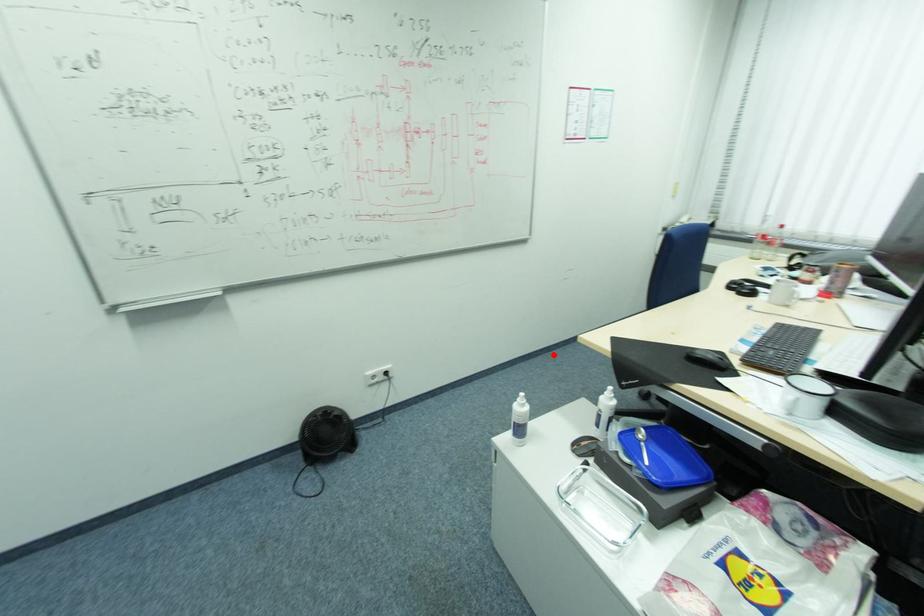
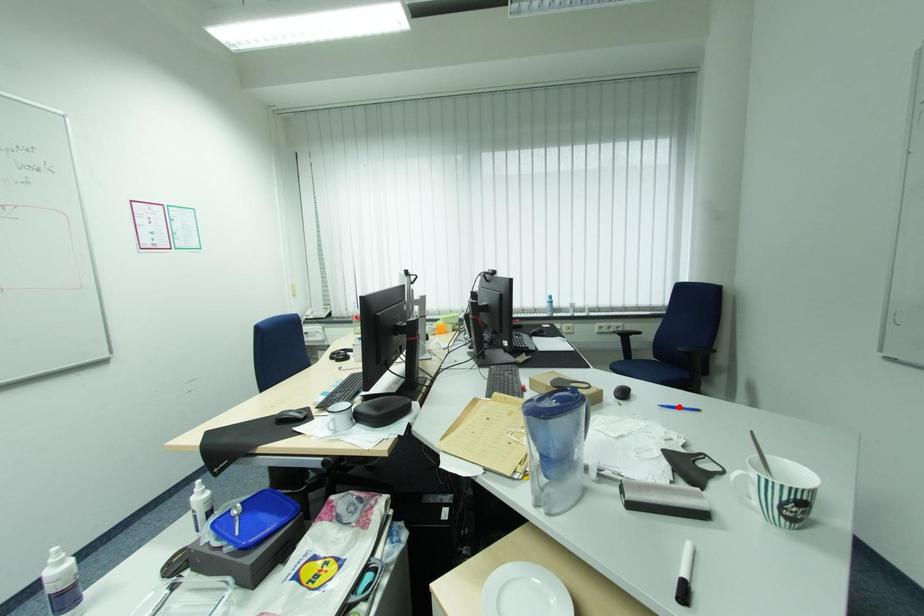
I am providing you with two images of the same scene from different viewpoints. A red point is marked on the first image and another point is marked on the second image. Are the points marked in image1 and image2 representing the same 3D position?

No